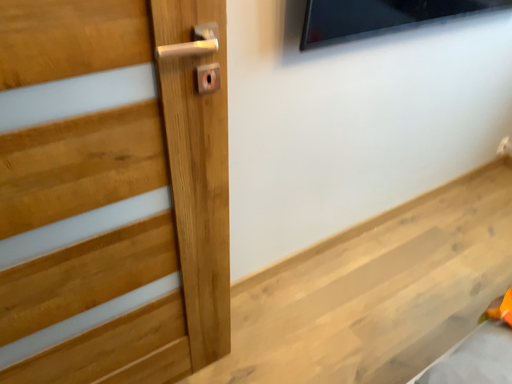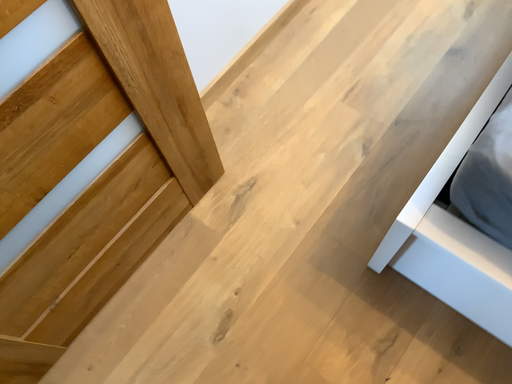
Question: How did the camera likely rotate when shooting the video?

Choices:
 (A) rotated right
 (B) rotated left

Answer: (A)